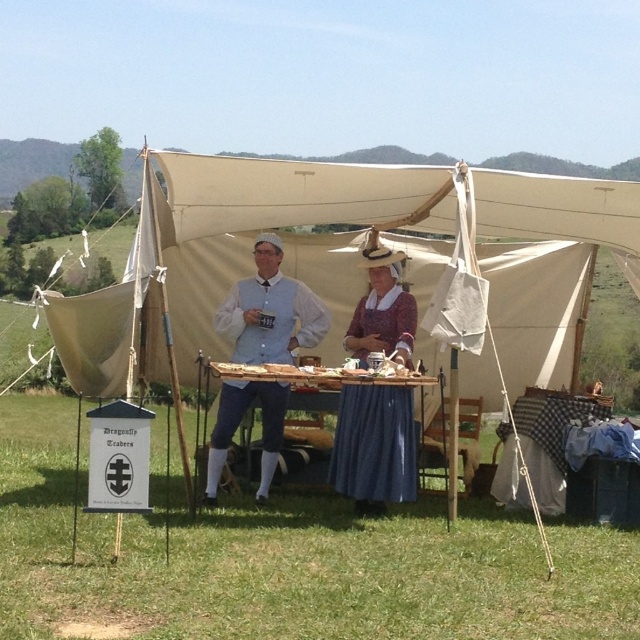
You are standing outside the beige canvas tent at center and want to enter. Which direction should you walk to reach the blue fabric table at center first?

The beige canvas tent at center is to the right of the blue fabric table at center. Therefore, to reach the blue fabric table at center first, you should walk to the left from the beige canvas tent at center.

You are setting up a historical reenactment event and need to place two tables inside the tent. The rustic wooden table at center and the blue fabric table at center must be arranged so that the wider table is placed closer to the entrance for easier access. Which table should be placed near the entrance?

The blue fabric table at center has a greater width than the rustic wooden table at center, so it should be placed closer to the entrance for easier access.

You are standing inside the tent and want to place a small decoration between the two points labeled point (392, 451) and point (264, 429). Which point should you place it closer to in order to make it appear larger to someone looking from the entrance?

To make the decoration appear larger, you should place it closer to point (392, 451) because it is closer to the viewer. Objects placed nearer to the viewer appear larger in size.